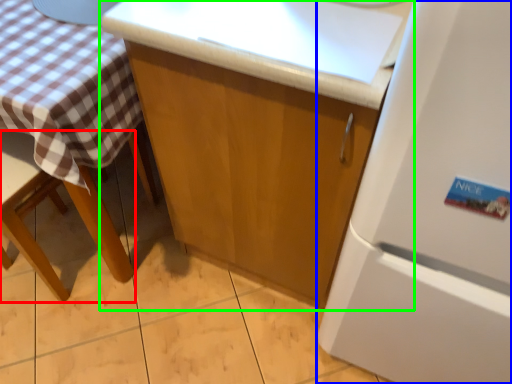
Question: Which object is the closest to the chair (highlighted by a red box)? Choose among these: refrigerator (highlighted by a blue box) or cabinetry (highlighted by a green box).

Choices:
 (A) refrigerator
 (B) cabinetry

Answer: (B)